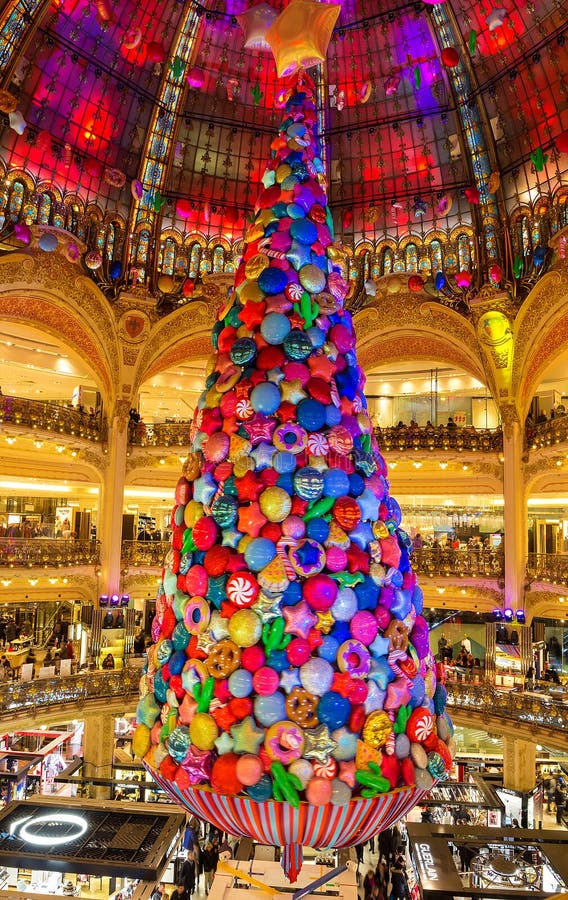
Where is `decoration`? This screenshot has width=568, height=900. decoration is located at coordinates (281, 820).